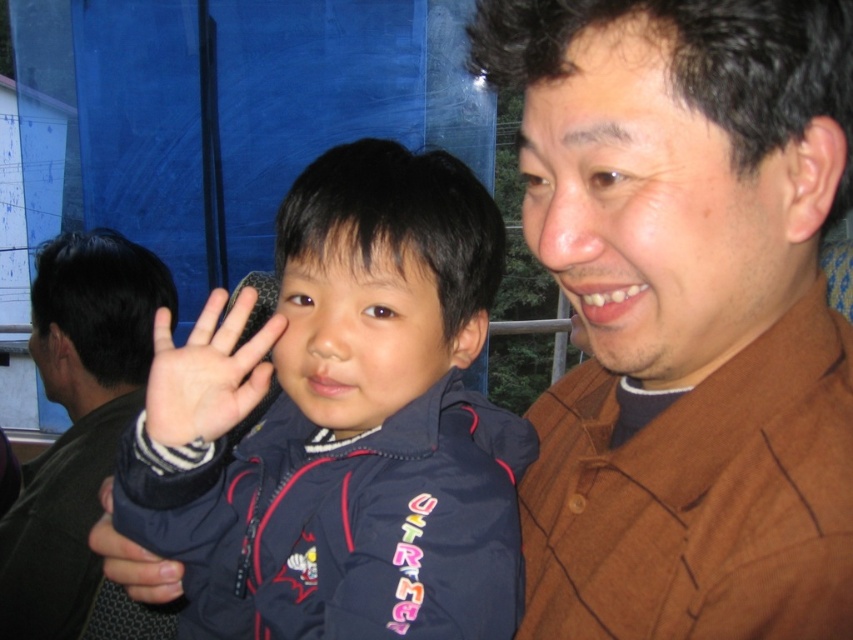
Describe the element at coordinates (685, 312) in the screenshot. The width and height of the screenshot is (853, 640). I see `brown textured shirt at upper right` at that location.

Is point (639, 588) more distant than point (44, 344)?

No.

Which is behind, point (746, 435) or point (136, 256)?

Point (136, 256)

Where is `brown textured shirt at upper right`? brown textured shirt at upper right is located at coordinates (685, 312).

How much distance is there between brown textured shirt at right and smooth skin hand at center?

brown textured shirt at right is 39.10 inches from smooth skin hand at center.

Is point (102, 308) closer to camera compared to point (212, 339)?

No, it is not.

Where is `brown textured shirt at right`? The height and width of the screenshot is (640, 853). brown textured shirt at right is located at coordinates (77, 420).

Who is more distant from viewer, (200,321) or (131,554)?

The point (131,554) is behind.

Is point (136, 506) less distant than point (154, 593)?

Yes, it is.

Measure the distance between point (409, 449) and camera.

The distance of point (409, 449) from camera is 23.18 inches.

Where is `dark blue fleece jacket at center`? The width and height of the screenshot is (853, 640). dark blue fleece jacket at center is located at coordinates [x=341, y=422].